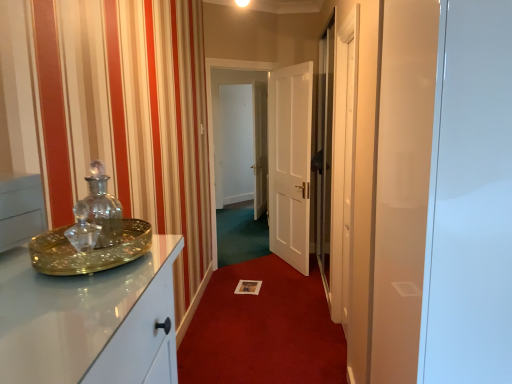
Question: Is point (27, 203) positioned closer to the camera than point (259, 276)?

Choices:
 (A) farther
 (B) closer

Answer: (B)

Question: Is matte glass tray at left inside the boundaries of white paper at center, or outside?

Choices:
 (A) inside
 (B) outside

Answer: (B)

Question: Which object is the farthest from the transparent glass door at center, which appears as the first glass door when viewed from the left?

Choices:
 (A) transparent glass door at right, acting as the second glass door starting from the left
 (B) matte glass tray at left
 (C) white wooden door at center
 (D) white paper at center

Answer: (B)

Question: Which object is positioned closest to the transparent glass door at center, positioned as the first glass door in back-to-front order?

Choices:
 (A) matte glass tray at left
 (B) white paper at center
 (C) white wooden door at center
 (D) transparent glass door at right, acting as the second glass door starting from the left

Answer: (C)